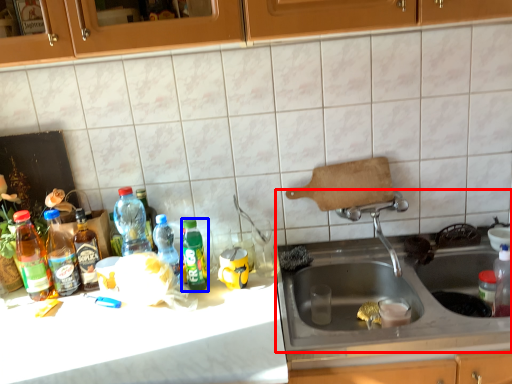
Question: Which object is closer to the camera taking this photo, sink (highlighted by a red box) or bottle (highlighted by a blue box)?

Choices:
 (A) sink
 (B) bottle

Answer: (A)